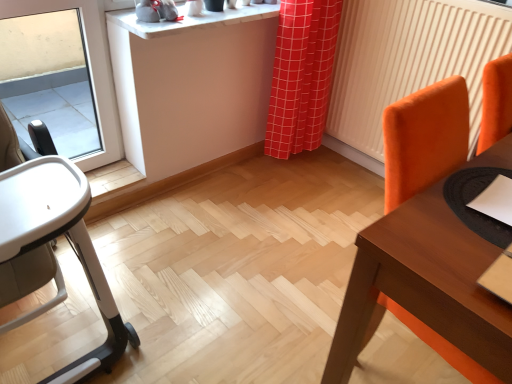
Identify the location of free space to the back side of beige fabric highchair at left. The width and height of the screenshot is (512, 384). (149, 229).